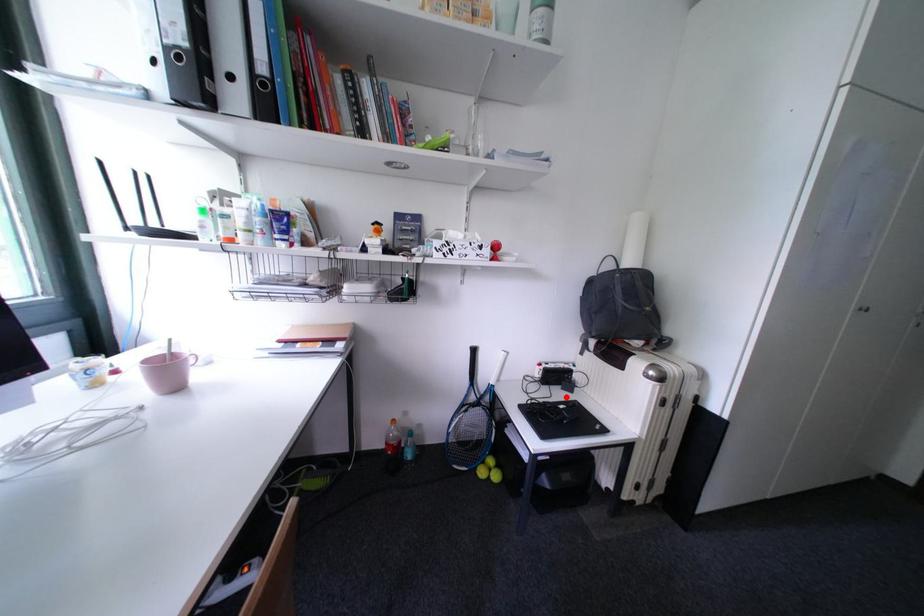
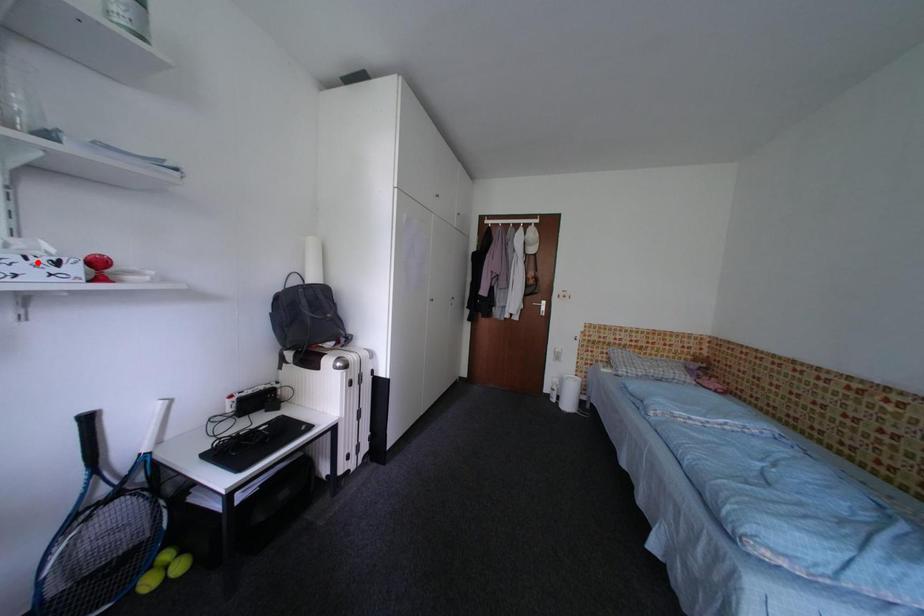
I am providing you with two images of the same scene from different viewpoints. A red point is marked on the first image and another point is marked on the second image. Is the marked point in image1 the same physical position as the marked point in image2?

No